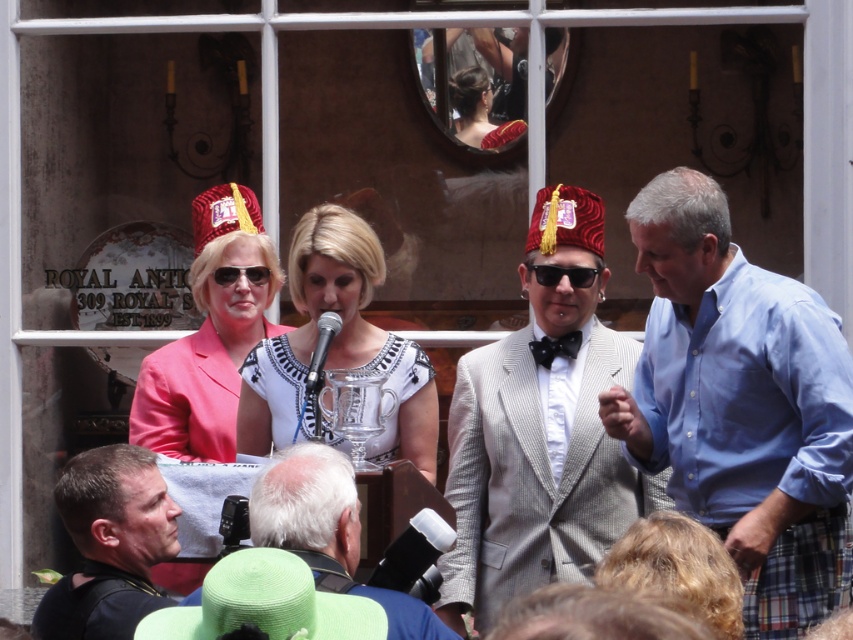
Does point (648, 253) come closer to viewer compared to point (463, 577)?

Yes, point (648, 253) is in front of point (463, 577).

Does blue cotton shirt at right have a larger size compared to silver pinstripe suit at center?

Correct, blue cotton shirt at right is larger in size than silver pinstripe suit at center.

At what (x,y) coordinates should I click in order to perform the action: click on blue cotton shirt at right. Please return your answer as a coordinate pair (x, y). Looking at the image, I should click on (741, 404).

Is point (234, 230) positioned behind point (103, 605)?

Yes.

This screenshot has height=640, width=853. I want to click on pink fabric hat at upper left, so click(209, 336).

Between point (148, 358) and point (55, 588), which one is positioned in front?

Point (55, 588) is in front.

Image resolution: width=853 pixels, height=640 pixels. In order to click on pink fabric hat at upper left in this screenshot , I will do `click(209, 336)`.

Is point (328, 208) farther from camera compared to point (109, 499)?

Yes, point (328, 208) is farther from viewer.

Does white textured dress at center have a smaller size compared to dark brown leather jacket at lower left?

Incorrect, white textured dress at center is not smaller in size than dark brown leather jacket at lower left.

Between point (258, 385) and point (138, 493), which one is positioned in front?

Positioned in front is point (138, 493).

Identify the location of white textured dress at center. (337, 344).